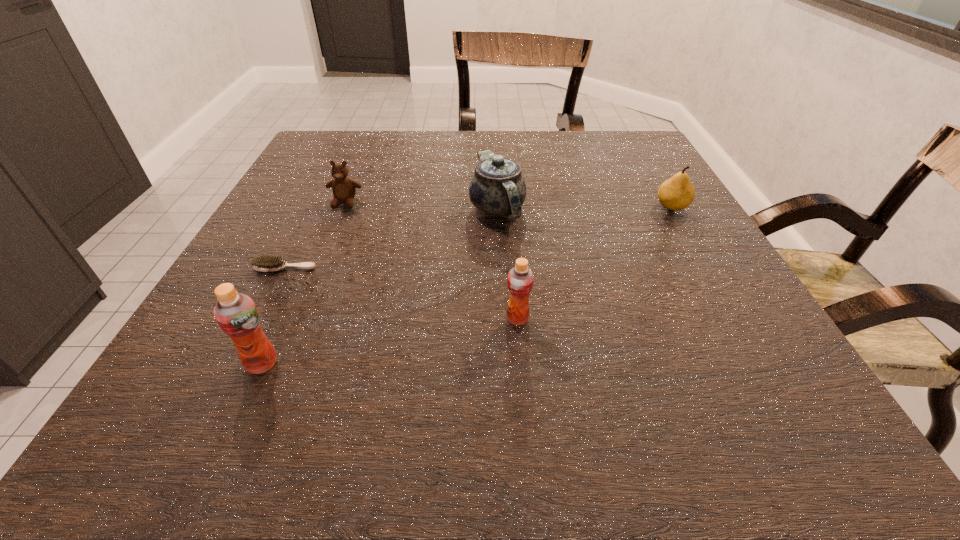
This screenshot has height=540, width=960. In order to click on vacant area situated 0.060m on the right of the shorter orange juice in this screenshot , I will do `click(567, 319)`.

Find the location of a particular element. The image size is (960, 540). vacant space located on the back of the pear is located at coordinates (638, 151).

Find the location of `free spot located 0.150m at the face of the teddy bear`. free spot located 0.150m at the face of the teddy bear is located at coordinates (324, 255).

Image resolution: width=960 pixels, height=540 pixels. What are the coordinates of `vacant region located from the spout of the chinaware` in the screenshot? It's located at (500, 264).

Image resolution: width=960 pixels, height=540 pixels. I want to click on vacant area situated on the right of the shortest object, so click(514, 268).

This screenshot has height=540, width=960. I want to click on object that is at the near edge, so click(x=236, y=314).

The width and height of the screenshot is (960, 540). What are the coordinates of `orange juice that is at the left edge` in the screenshot? It's located at (236, 314).

This screenshot has height=540, width=960. What are the coordinates of `teddy bear that is at the left edge` in the screenshot? It's located at (344, 189).

This screenshot has width=960, height=540. I want to click on scrubbing brush situated at the left edge, so click(x=267, y=263).

You are a GUI agent. You are given a task and a screenshot of the screen. Output one action in this format:
    pyautogui.click(x=<x>, y=<y>)
    Task: Click on the object present at the right edge
    
    Given the screenshot: What is the action you would take?
    pyautogui.click(x=677, y=193)